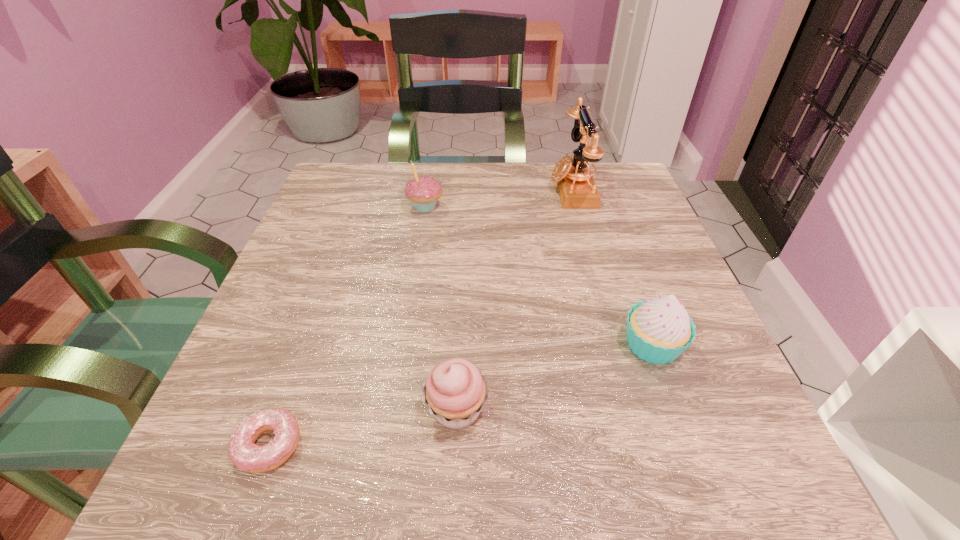
The image size is (960, 540). Identify the location of vacant space in between the tallest object and the leftmost object. (420, 316).

Point out which object is positioned as the third nearest to the farthest cupcake. Please provide its 2D coordinates. Your answer should be formatted as a tuple, i.e. [(x, y)], where the tuple contains the x and y coordinates of a point satisfying the conditions above.

[(659, 330)]

Locate an element on the screen. The image size is (960, 540). object that is the closest to the second cupcake from left to right is located at coordinates (243, 452).

What are the coordinates of `cupcake that is the second closest to the second object from left to right` in the screenshot? It's located at pyautogui.click(x=659, y=330).

Locate which cupcake is the second closest to the doughnut. Please provide its 2D coordinates. Your answer should be formatted as a tuple, i.e. [(x, y)], where the tuple contains the x and y coordinates of a point satisfying the conditions above.

[(659, 330)]

This screenshot has width=960, height=540. I want to click on free region that satisfies the following two spatial constraints: 1. on the dial of the tallest object; 2. on the left side of the third farthest object, so click(x=616, y=345).

Identify the location of free location that satisfies the following two spatial constraints: 1. on the dial of the second farthest cupcake; 2. on the right side of the telephone. This screenshot has height=540, width=960. (616, 345).